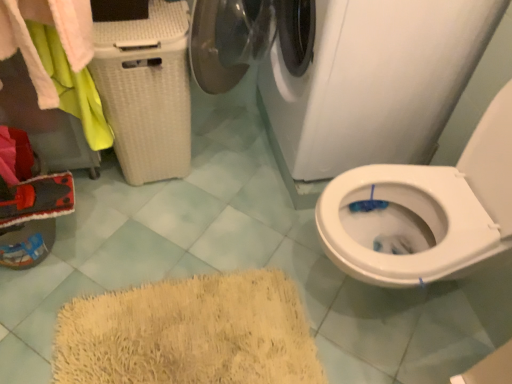
Question: From a real-world perspective, is white wicker laundry basket at left on white glossy washing machine at upper center?

Choices:
 (A) no
 (B) yes

Answer: (A)

Question: Considering the relative sizes of white wicker laundry basket at left and white glossy washing machine at upper center in the image provided, is white wicker laundry basket at left shorter than white glossy washing machine at upper center?

Choices:
 (A) no
 (B) yes

Answer: (B)

Question: From the image's perspective, is white wicker laundry basket at left below white glossy washing machine at upper center?

Choices:
 (A) yes
 (B) no

Answer: (A)

Question: Can we say white wicker laundry basket at left lies outside white glossy washing machine at upper center?

Choices:
 (A) yes
 (B) no

Answer: (A)

Question: Is white wicker laundry basket at left at the right side of white glossy washing machine at upper center?

Choices:
 (A) no
 (B) yes

Answer: (A)

Question: Could you tell me if white wicker laundry basket at left is facing white glossy washing machine at upper center?

Choices:
 (A) no
 (B) yes

Answer: (A)

Question: Considering the relative sizes of white wicker laundry basket at left and white glossy washing machine at upper center in the image provided, is white wicker laundry basket at left wider than white glossy washing machine at upper center?

Choices:
 (A) yes
 (B) no

Answer: (B)

Question: From a real-world perspective, does white wicker laundry basket at left stand above white glossy washing machine at upper center?

Choices:
 (A) yes
 (B) no

Answer: (A)

Question: Could white glossy washing machine at upper center be considered to be inside white wicker laundry basket at left?

Choices:
 (A) yes
 (B) no

Answer: (B)

Question: Considering the relative sizes of white wicker laundry basket at left and white glossy washing machine at upper center in the image provided, is white wicker laundry basket at left shorter than white glossy washing machine at upper center?

Choices:
 (A) no
 (B) yes

Answer: (B)

Question: Is white wicker laundry basket at left not within white glossy washing machine at upper center?

Choices:
 (A) yes
 (B) no

Answer: (A)

Question: Is white wicker laundry basket at left oriented away from white glossy washing machine at upper center?

Choices:
 (A) no
 (B) yes

Answer: (A)

Question: Can you confirm if white glossy washing machine at upper center is bigger than white wicker laundry basket at left?

Choices:
 (A) yes
 (B) no

Answer: (A)